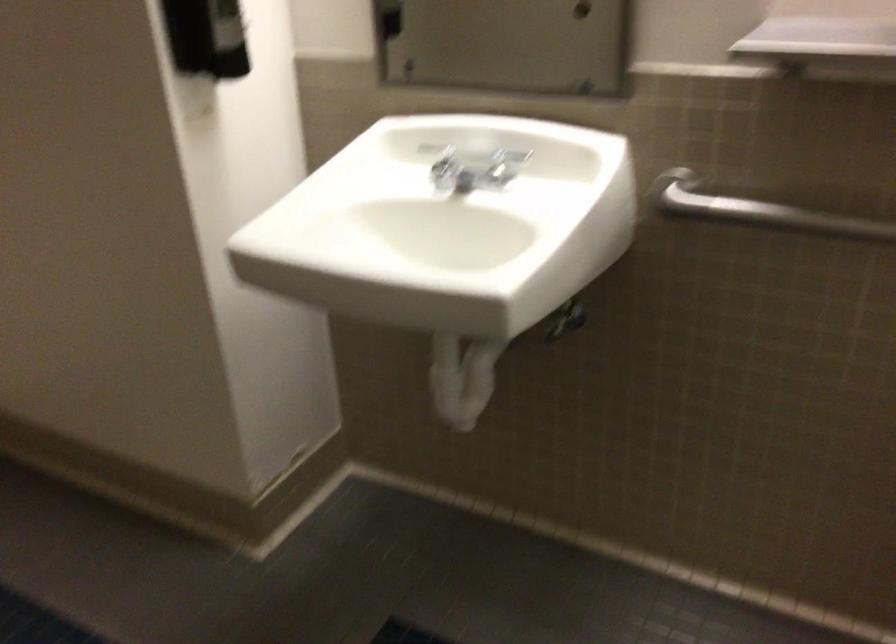
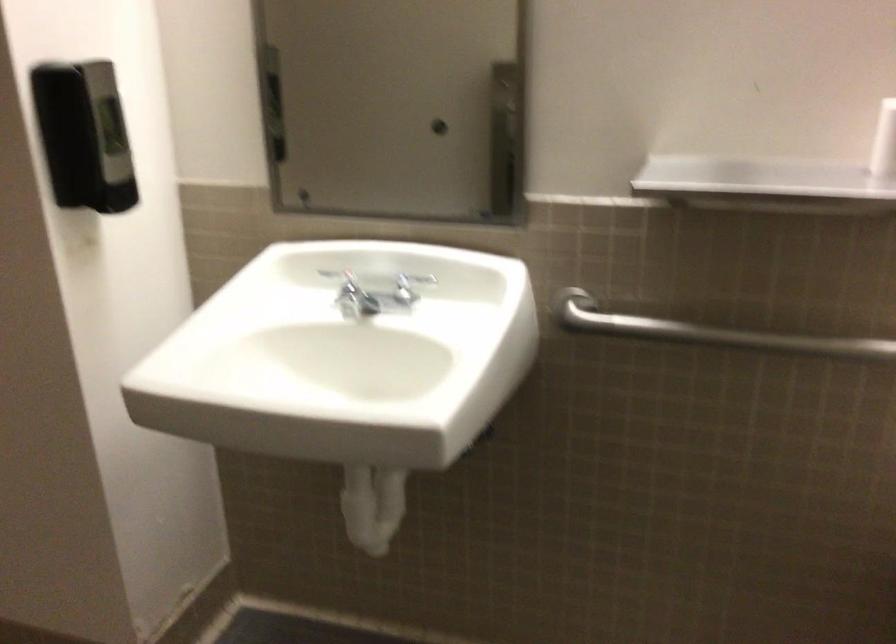
Where in the second image is the point corresponding to the point at 810,219 from the first image?

(707, 332)